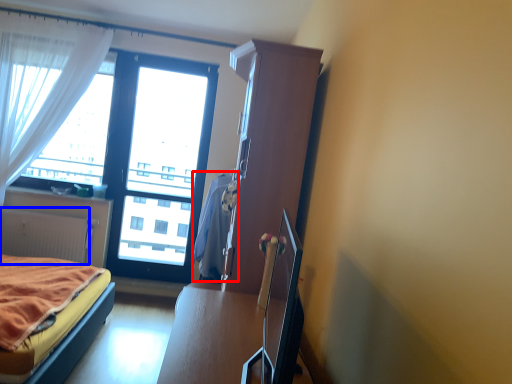
Question: Which point is closer to the camera, blanket (highlighted by a red box) or radiator (highlighted by a blue box)?

Choices:
 (A) blanket
 (B) radiator

Answer: (A)